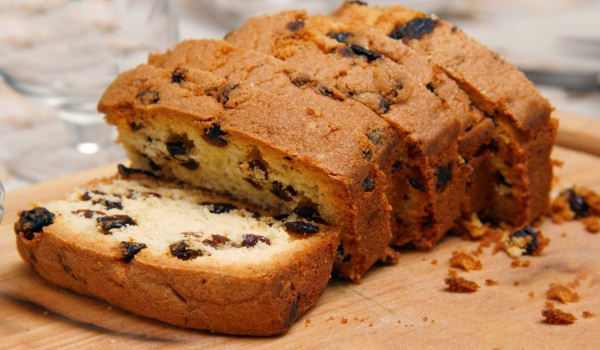
This screenshot has width=600, height=350. What are the coordinates of `open area of brown wood cutting board` in the screenshot? It's located at [382, 335], [400, 324], [466, 321], [38, 325].